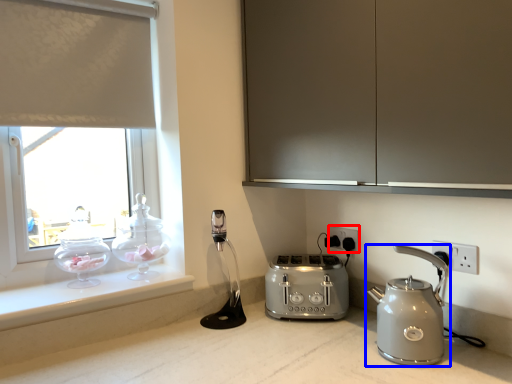
Question: Which object is further to the camera taking this photo, electric outlet (highlighted by a red box) or kettle (highlighted by a blue box)?

Choices:
 (A) electric outlet
 (B) kettle

Answer: (A)